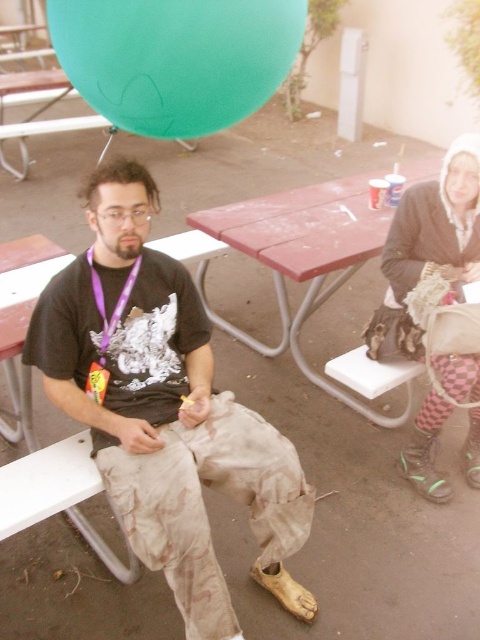
Question: Can you confirm if camouflage pants at center is thinner than red plastic picnic table at center?

Choices:
 (A) yes
 (B) no

Answer: (A)

Question: Is checkered fabric pants at right above purple fabric lanyard at center?

Choices:
 (A) no
 (B) yes

Answer: (B)

Question: Does green rubber balloon at upper left have a smaller size compared to white plastic picnic table at left?

Choices:
 (A) no
 (B) yes

Answer: (A)

Question: Among these points, which one is farthest from the camera?

Choices:
 (A) (471, 166)
 (B) (144, 292)
 (C) (106, 326)

Answer: (A)

Question: Which point appears farthest from the camera in this image?

Choices:
 (A) (208, 364)
 (B) (458, 262)

Answer: (B)

Question: Considering the real-world distances, which object is closest to the purple fabric lanyard at center?

Choices:
 (A) red plastic picnic table at center
 (B) camouflage pants at center
 (C) white plastic bench at lower left

Answer: (B)